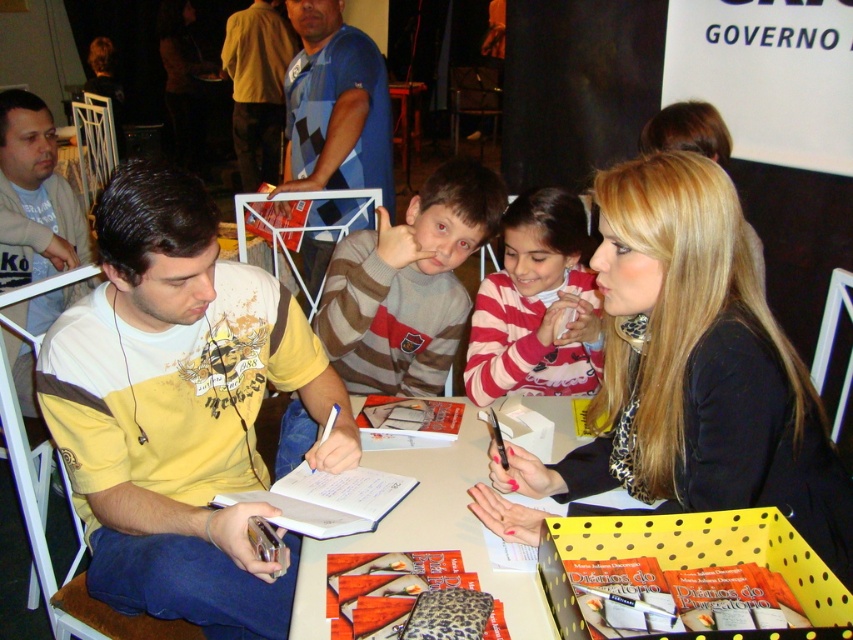
Question: Considering the real-world distances, which object is farthest from the striped cotton shirt at center?

Choices:
 (A) blue checkered shirt at upper center
 (B) yellow cotton shirt at left
 (C) striped sweater at center

Answer: (B)

Question: Is yellow cotton shirt at left in front of yellow polka dot cardboard box at center?

Choices:
 (A) yes
 (B) no

Answer: (B)

Question: Does striped sweater at center have a smaller size compared to blue checkered shirt at upper center?

Choices:
 (A) no
 (B) yes

Answer: (B)

Question: Does striped sweater at center appear on the left side of striped cotton shirt at center?

Choices:
 (A) yes
 (B) no

Answer: (A)

Question: Among these points, which one is farthest from the camera?

Choices:
 (A) (109, 388)
 (B) (415, 355)
 (C) (556, 225)

Answer: (B)

Question: Considering the real-world distances, which object is farthest from the yellow polka dot cardboard box at center?

Choices:
 (A) blue checkered shirt at upper center
 (B) striped sweater at center

Answer: (A)